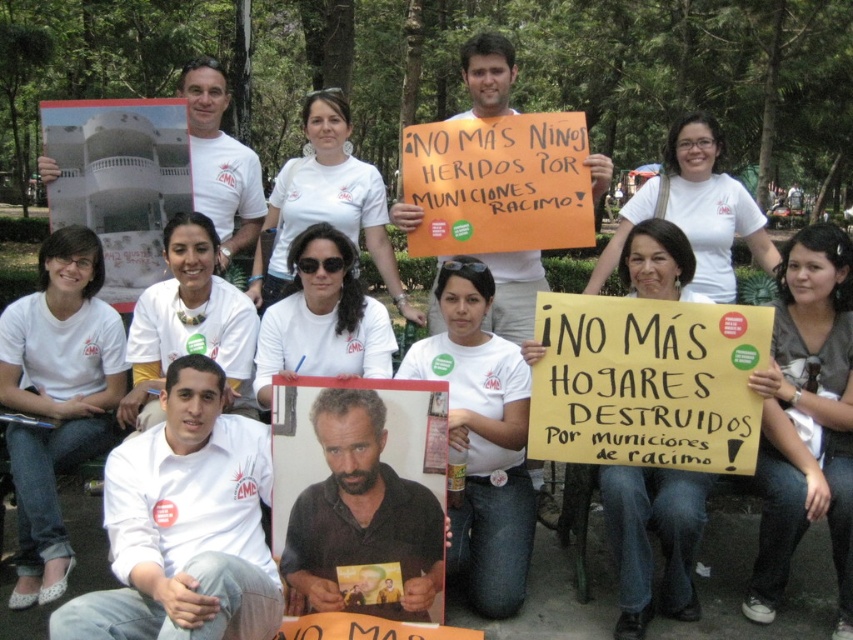
Question: Observing the image, what is the correct spatial positioning of matte cardboard placard at center in reference to white fabric shirt at lower left?

Choices:
 (A) below
 (B) above

Answer: (A)

Question: Can you confirm if matte cardboard placard at center is positioned below white fabric shirt at lower left?

Choices:
 (A) yes
 (B) no

Answer: (A)

Question: Observing the image, what is the correct spatial positioning of matte cardboard placard at center in reference to white fabric shirt at lower left?

Choices:
 (A) right
 (B) left

Answer: (A)

Question: Which point is farther from the camera taking this photo?

Choices:
 (A) click(x=328, y=433)
 (B) click(x=61, y=422)

Answer: (B)

Question: Which point is closer to the camera?

Choices:
 (A) matte cardboard placard at center
 (B) white fabric shirt at lower left

Answer: (A)